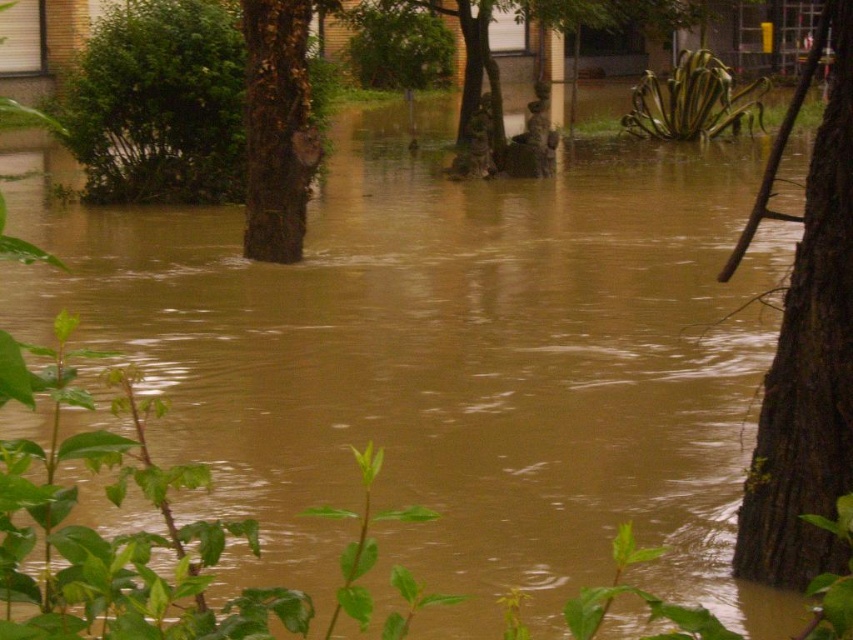
Does brown rough bark tree at right have a smaller size compared to brown rough bark tree at center?

Yes, brown rough bark tree at right is smaller than brown rough bark tree at center.

Is brown rough bark tree at right further to camera compared to brown rough bark tree at center?

No, it is in front of brown rough bark tree at center.

Who is more distant from viewer, (787, 310) or (282, 220)?

Positioned behind is point (282, 220).

Where is `brown rough bark tree at right`? The width and height of the screenshot is (853, 640). brown rough bark tree at right is located at coordinates (805, 346).

Looking at this image, can you confirm if brown rough bark tree at right is wider than green leafy bush at upper left?

Incorrect, brown rough bark tree at right's width does not surpass green leafy bush at upper left's.

Is brown rough bark tree at right above green leafy bush at upper left?

No.

Measure the distance between point (805, 257) and camera.

A distance of 19.15 feet exists between point (805, 257) and camera.

At what (x,y) coordinates should I click in order to perform the action: click on brown rough bark tree at right. Please return your answer as a coordinate pair (x, y). This screenshot has height=640, width=853. Looking at the image, I should click on (805, 346).

Is green leafy bush at upper left above brown rough bark tree at center?

Yes.

Does point (222, 148) lie in front of point (286, 216)?

No, (222, 148) is behind (286, 216).

This screenshot has height=640, width=853. I want to click on green leafy bush at upper left, so click(158, 104).